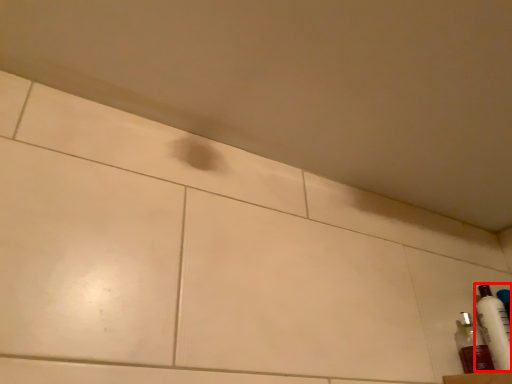
Question: From the image's perspective, where is bottle (annotated by the red box) located in relation to bottle in the image?

Choices:
 (A) below
 (B) above

Answer: (B)